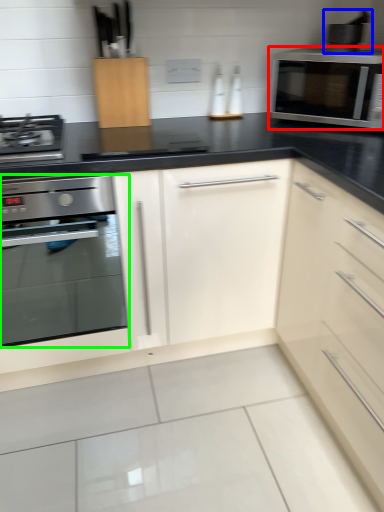
Question: Which object is the farthest from microwave oven (highlighted by a red box)? Choose among these: appliance (highlighted by a blue box) or oven (highlighted by a green box).

Choices:
 (A) appliance
 (B) oven

Answer: (B)